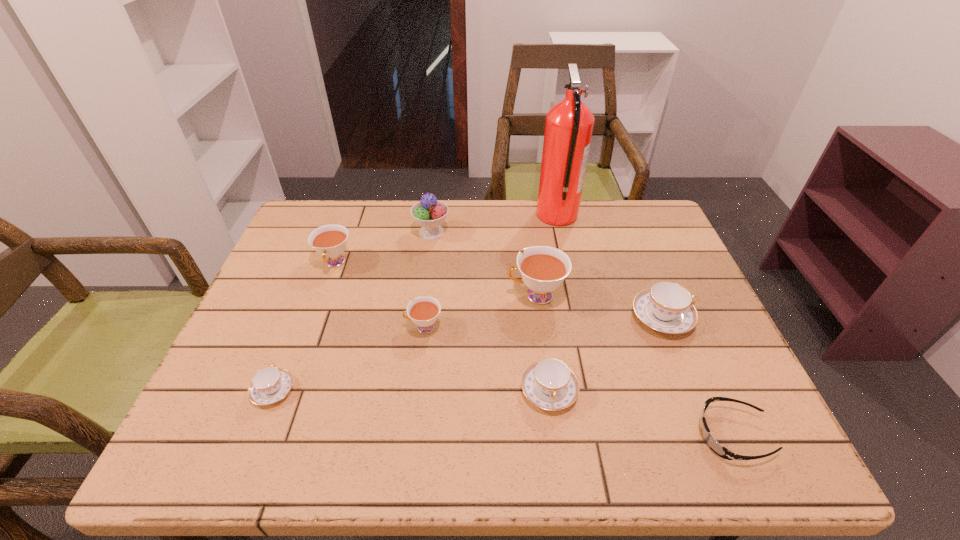
Where is `vacant space situated on the side of the rightmost white teacup with the handle`? vacant space situated on the side of the rightmost white teacup with the handle is located at coordinates (371, 295).

In order to click on free space located 0.280m on the side of the farthest white teacup with the handle in this screenshot , I will do pos(299,363).

Find the location of a particular element. This screenshot has height=540, width=960. free location located 0.130m on the side of the second white teacup from right to left with the handle is located at coordinates (350, 327).

Where is `vacant space located 0.140m on the side of the second white teacup from right to left with the handle`? The height and width of the screenshot is (540, 960). vacant space located 0.140m on the side of the second white teacup from right to left with the handle is located at coordinates (347, 327).

Where is `vacant space situated on the side of the second white teacup from right to left with the handle`? The width and height of the screenshot is (960, 540). vacant space situated on the side of the second white teacup from right to left with the handle is located at coordinates (254, 327).

In order to click on vacant region located on the side with the handle of the second biggest blue teacup in this screenshot , I will do `click(557, 450)`.

Identify the location of free location located 0.070m on the side with the handle of the leftmost blue teacup. (290, 347).

Identify the location of vacant space located on the side with the handle of the leftmost blue teacup. The height and width of the screenshot is (540, 960). (293, 340).

You are a GUI agent. You are given a task and a screenshot of the screen. Output one action in this format:
    pyautogui.click(x=<x>, y=<y>)
    Task: Click on the vacant space located 0.130m on the side with the handle of the leftmost blue teacup
    The width and height of the screenshot is (960, 540).
    Given the screenshot: What is the action you would take?
    pyautogui.click(x=299, y=327)

The image size is (960, 540). Find the location of `free space located on the lenses of the shortest object`. free space located on the lenses of the shortest object is located at coordinates (594, 435).